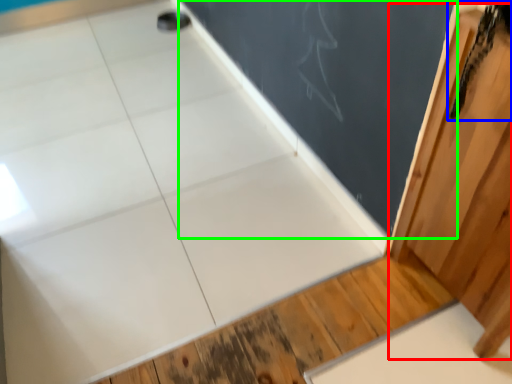
Question: Based on their relative distances, which object is farther from barn door (highlighted by a red box)? Choose from animal (highlighted by a blue box) and bulletin board (highlighted by a green box).

Choices:
 (A) animal
 (B) bulletin board

Answer: (B)